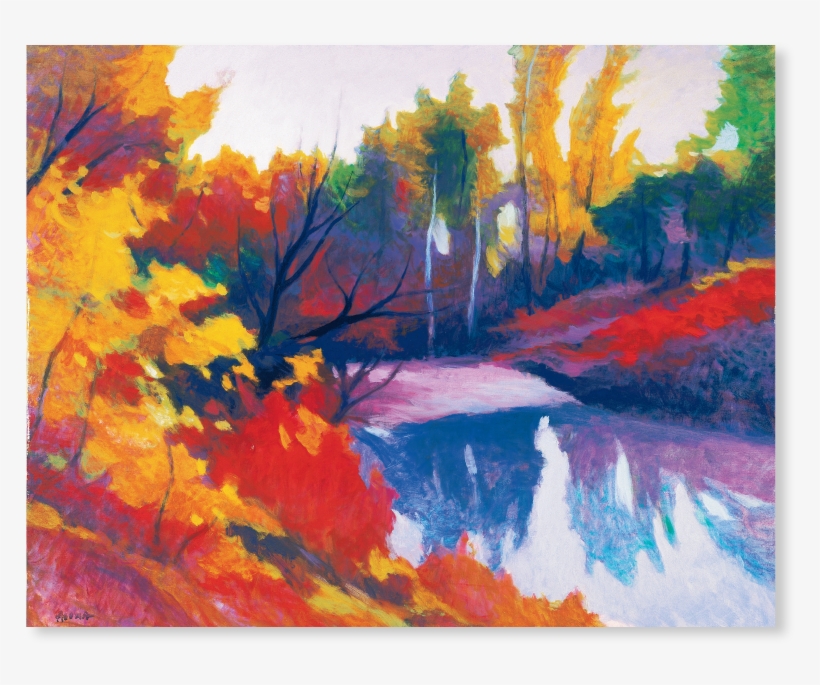
Find the location of `painting of tree trunk`. painting of tree trunk is located at coordinates (476, 261), (426, 259), (529, 277), (686, 255), (643, 238), (732, 238).